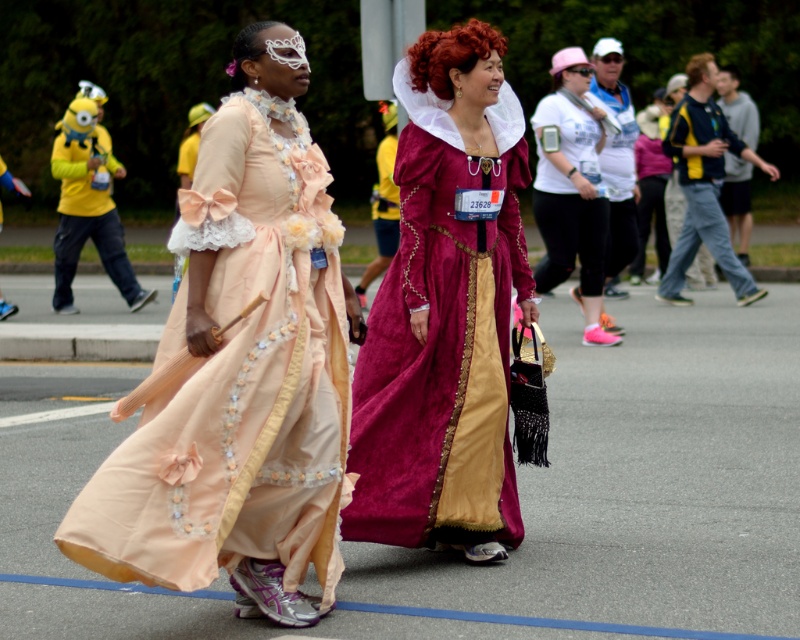
Question: Is pale pink satin dress at left smaller than white lace wig at upper center?

Choices:
 (A) yes
 (B) no

Answer: (A)

Question: Considering the relative positions of white fabric at center and yellow-green fabric robe at right in the image provided, where is white fabric at center located with respect to yellow-green fabric robe at right?

Choices:
 (A) left
 (B) right

Answer: (A)

Question: Among these objects, which one is nearest to the camera?

Choices:
 (A) curly red wig at upper center
 (B) velvet maroon gown at center
 (C) white lace wig at upper center
 (D) white fabric at center

Answer: (C)

Question: Among these objects, which one is farthest from the camera?

Choices:
 (A) yellow plush toy at left
 (B) curly red wig at upper center
 (C) yellow-green fabric robe at right
 (D) white fabric at center

Answer: (A)

Question: Which point is closer to the camera?

Choices:
 (A) (462, 275)
 (B) (688, 65)

Answer: (A)

Question: Considering the relative positions of curly red wig at upper center and white lace wig at upper center in the image provided, where is curly red wig at upper center located with respect to white lace wig at upper center?

Choices:
 (A) above
 (B) below

Answer: (A)